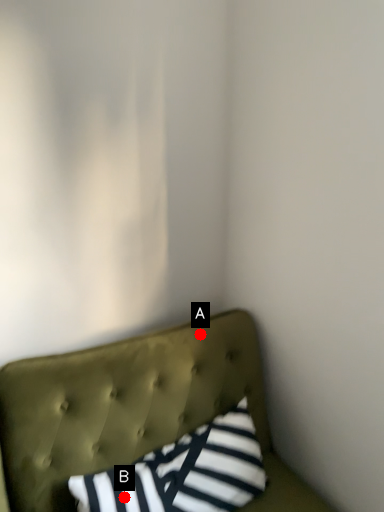
Question: Two points are circled on the image, labeled by A and B beside each circle. Among these points, which one is nearest to the camera?

Choices:
 (A) A is closer
 (B) B is closer

Answer: (B)